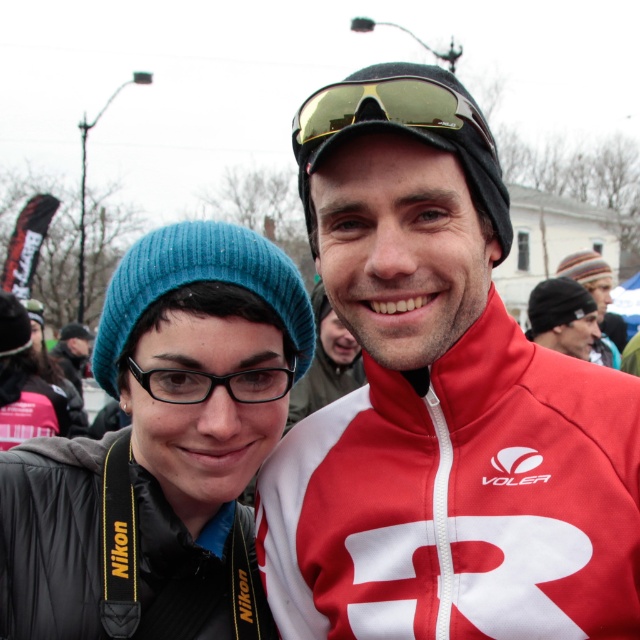
You are a photographer trying to capture both the matte red jacket at center and the black knit cap at upper center in a single frame. Based on their sizes in the image, which object should you focus on first to ensure both are in focus?

The matte red jacket at center occupies less space than the black knit cap at upper center, so you should focus on the black knit cap at upper center first since it is larger and will require more precise focusing to ensure both are in focus.

You are a photographer trying to capture a clear shot of the matte red jacket at center without the black knit cap at upper center blocking it. Based on their positions, is this possible?

The matte red jacket at center is in front of the black knit cap at upper center, so it would block the view of the cap. To capture a clear shot of the jacket without the cap blocking it, you might need to adjust your angle or have the subject move slightly so the jacket is positioned away from the cap.

You are a photographer trying to capture a closeup shot of the black knit cap at upper center without including the matte red jacket at center in the frame. Based on their sizes, is this possible?

The matte red jacket at center has a larger width than the black knit cap at upper center. Since the jacket is wider, it might block the view of the cap unless you adjust your angle or zoom in closely to exclude the wider jacket from the frame.